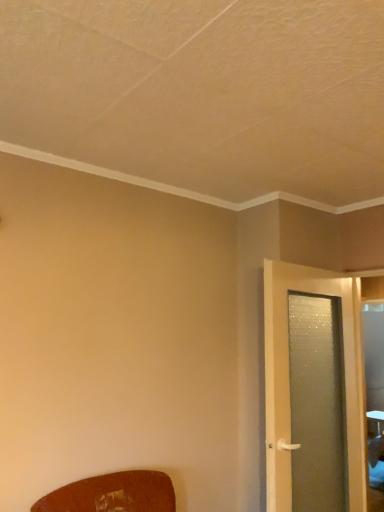
The width and height of the screenshot is (384, 512). What do you see at coordinates (288, 376) in the screenshot?
I see `white frosted glass door at right` at bounding box center [288, 376].

Locate an element on the screen. The width and height of the screenshot is (384, 512). white frosted glass door at right is located at coordinates (288, 376).

Where is `white frosted glass door at right`? white frosted glass door at right is located at coordinates (288, 376).